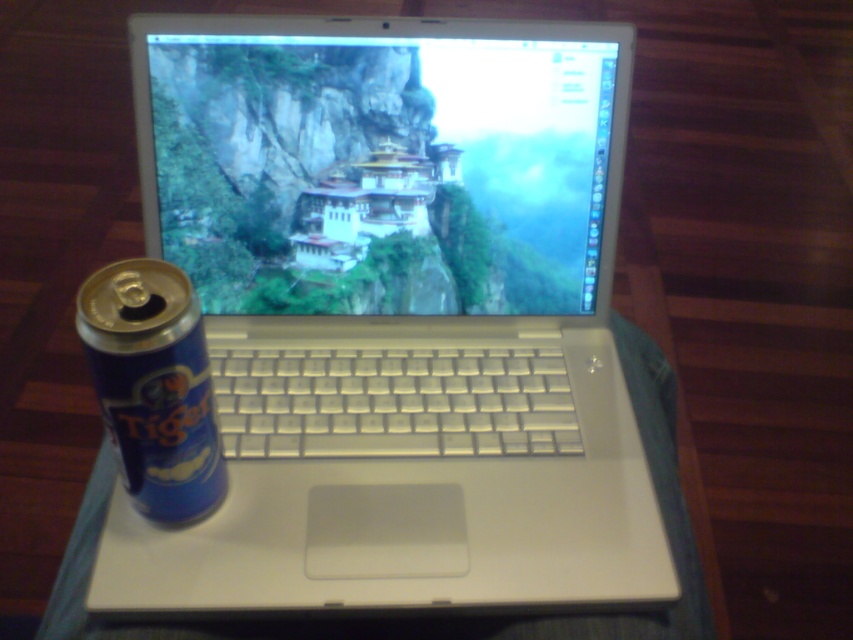
Which is below, white plastic laptop at center or metallic silver laptop at center?

white plastic laptop at center

Is point (509, 337) positioned after point (206, 68)?

Yes, it is.

Is point (260, 282) more distant than point (416, 115)?

Yes, it is.

Where is `white plastic laptop at center`? white plastic laptop at center is located at coordinates (393, 316).

Which is in front, point (177, 208) or point (132, 449)?

Point (132, 449) is in front.

Who is taller, metallic silver laptop at center or blue metallic can at left?

Standing taller between the two is metallic silver laptop at center.

This screenshot has width=853, height=640. What are the coordinates of `metallic silver laptop at center` in the screenshot? It's located at (381, 172).

Who is lower down, white plastic laptop at center or blue metallic can at left?

blue metallic can at left is lower down.

Identify the location of white plastic laptop at center. This screenshot has width=853, height=640. (393, 316).